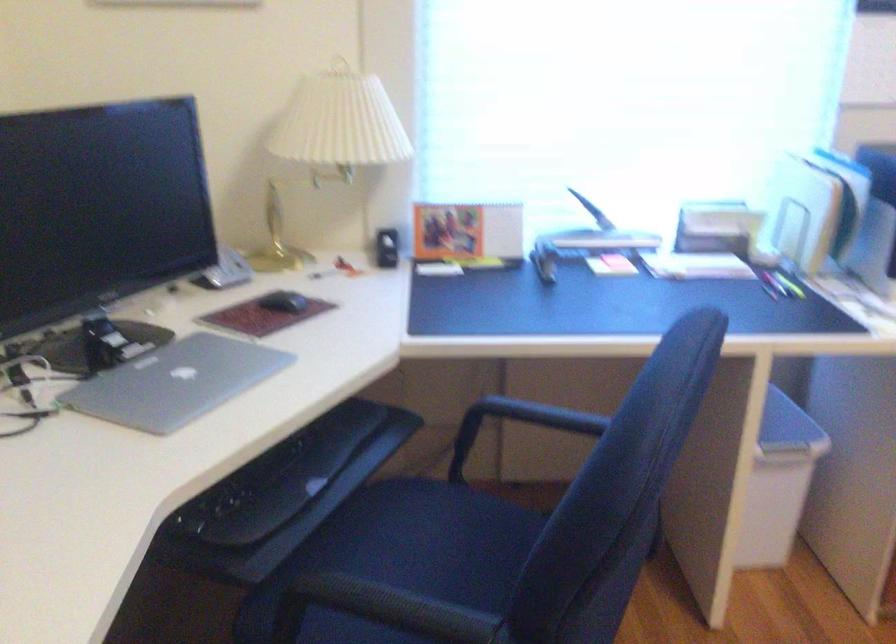
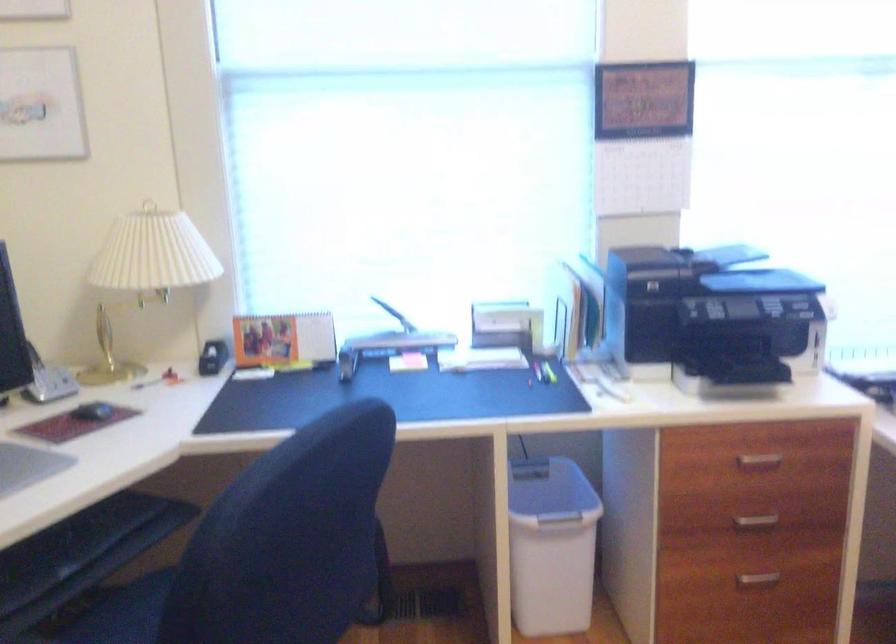
In the scene shown: What movement of the cameraman would produce the second image?

The cameraman moved toward right, backward.